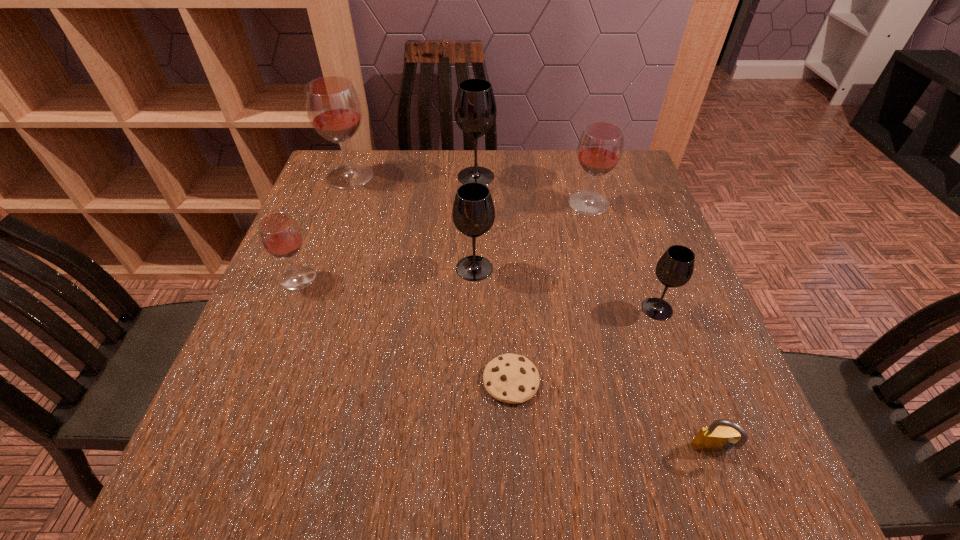
Locate an element on the screen. The image size is (960, 540). blank region between the second smallest red wineglass and the second biggest gray wineglass is located at coordinates (532, 236).

Find the location of a particular element. The width and height of the screenshot is (960, 540). vacant area between the cookie and the smallest red wineglass is located at coordinates (404, 329).

What are the coordinates of `vacant point located between the smallest gray wineglass and the nearest red wineglass` in the screenshot? It's located at (478, 293).

This screenshot has height=540, width=960. What are the coordinates of `empty location between the second nearest red wineglass and the smallest gray wineglass` in the screenshot? It's located at (623, 256).

Identify the location of free area in between the sixth nearest object and the seventh farthest object. (550, 292).

Where is `free space between the biggest red wineglass and the nearest object`? The image size is (960, 540). free space between the biggest red wineglass and the nearest object is located at coordinates (532, 314).

The image size is (960, 540). Find the location of `free space between the farthest red wineglass and the nearest wineglass`. free space between the farthest red wineglass and the nearest wineglass is located at coordinates (504, 242).

This screenshot has height=540, width=960. In order to click on free area in between the third farthest wineglass and the shortest object in this screenshot , I will do `click(550, 292)`.

Where is `unoccupied area between the farthest red wineglass and the padlock`? This screenshot has width=960, height=540. unoccupied area between the farthest red wineglass and the padlock is located at coordinates coord(532,314).

Point out which object is positioned as the fifth nearest to the farthest red wineglass. Please provide its 2D coordinates. Your answer should be formatted as a tuple, i.e. [(x, y)], where the tuple contains the x and y coordinates of a point satisfying the conditions above.

[(510, 378)]